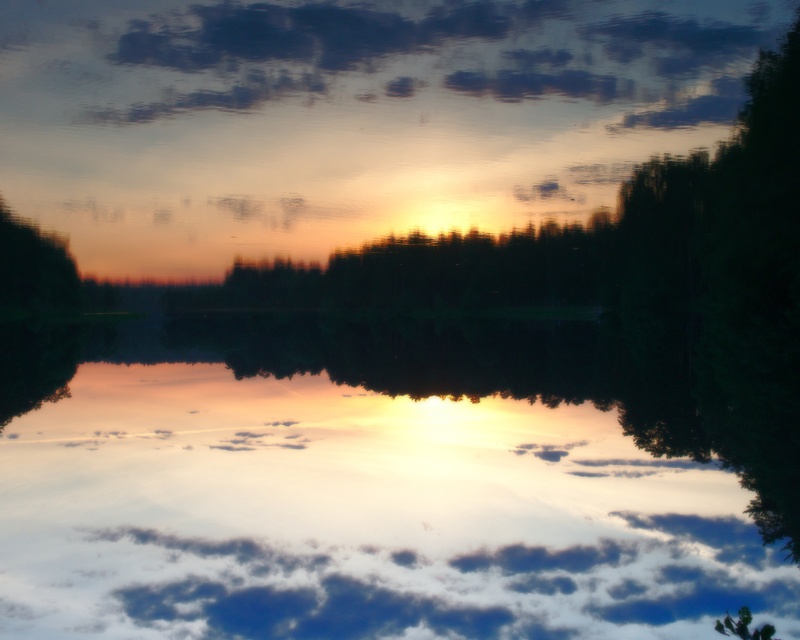
Is point (550, 560) positioned after point (420, 106)?

That is False.

Can you confirm if transparent water at center is positioned below cloudy sky at upper center?

Yes, transparent water at center is below cloudy sky at upper center.

Between point (281, 595) and point (236, 60), which one is positioned behind?

Positioned behind is point (236, 60).

Locate an element on the screen. The width and height of the screenshot is (800, 640). transparent water at center is located at coordinates (362, 484).

Does transparent water at center have a lesser height compared to green matte tree at left?

Yes, transparent water at center is shorter than green matte tree at left.

Locate an element on the screen. The height and width of the screenshot is (640, 800). transparent water at center is located at coordinates (362, 484).

Can you confirm if cloudy sky at upper center is positioned above green matte tree at left?

Yes, cloudy sky at upper center is above green matte tree at left.

Is point (165, 189) positioned in front of point (20, 296)?

No, it is behind (20, 296).

Where is `cloudy sky at upper center`? cloudy sky at upper center is located at coordinates (346, 116).